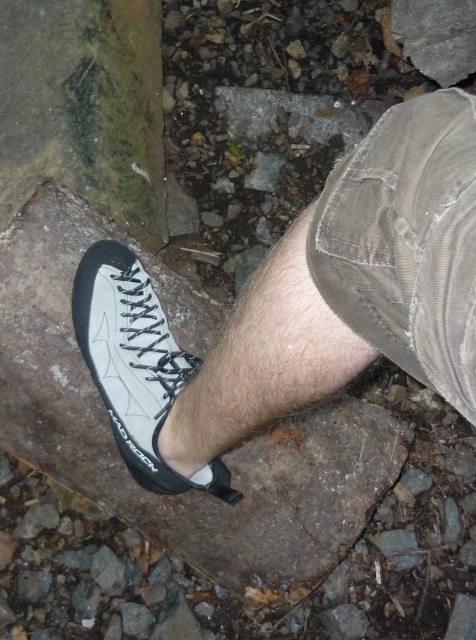
Can you confirm if white leather shoe at center is positioned above white matte climbing shoe at center?

Indeed, white leather shoe at center is positioned over white matte climbing shoe at center.

Which is above, white leather shoe at center or white matte climbing shoe at center?

white leather shoe at center

At what (x,y) coordinates should I click in order to perform the action: click on white leather shoe at center. Please return your answer as a coordinate pair (x, y). The width and height of the screenshot is (476, 640). Looking at the image, I should click on (303, 304).

Locate an element on the screen. The image size is (476, 640). white leather shoe at center is located at coordinates (303, 304).

Is white leather shoe at center thinner than smooth gray rock at center?

Yes, white leather shoe at center is thinner than smooth gray rock at center.

Can you confirm if white leather shoe at center is wider than smooth gray rock at center?

No, white leather shoe at center is not wider than smooth gray rock at center.

Does point (198, 472) lie behind point (82, 362)?

No, (198, 472) is in front of (82, 362).

I want to click on white leather shoe at center, so click(303, 304).

Is smooth gray rock at center to the right of white matte climbing shoe at center from the viewer's perspective?

Yes, smooth gray rock at center is to the right of white matte climbing shoe at center.

Which of these two, smooth gray rock at center or white matte climbing shoe at center, stands shorter?

white matte climbing shoe at center

This screenshot has width=476, height=640. Describe the element at coordinates (227, 454) in the screenshot. I see `smooth gray rock at center` at that location.

Locate an element on the screen. The width and height of the screenshot is (476, 640). smooth gray rock at center is located at coordinates point(227,454).